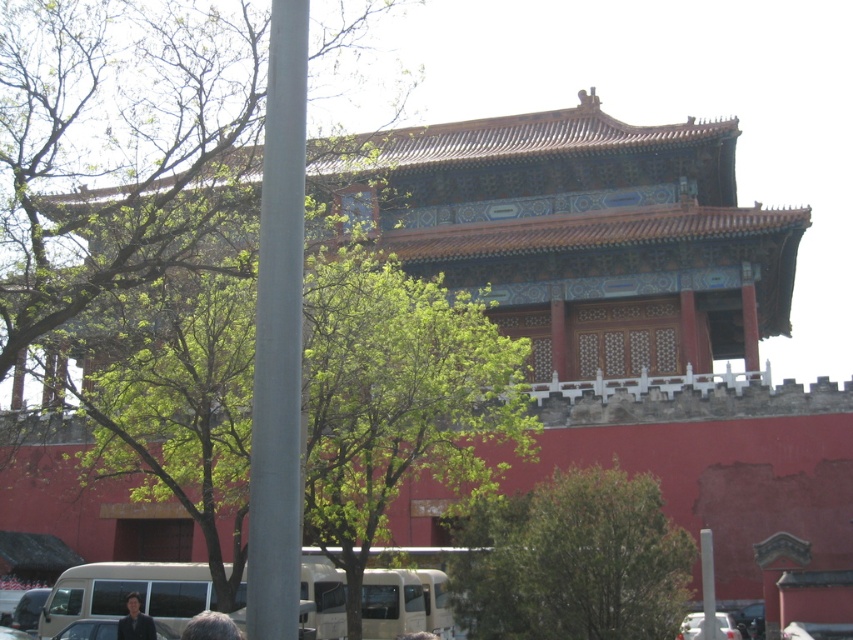
Question: Which point is farther to the camera?

Choices:
 (A) white matte car at lower right
 (B) dark brown hair at lower center
 (C) gray hair at center

Answer: (A)

Question: Does green leafy tree at center appear under white glossy pole at lower right?

Choices:
 (A) no
 (B) yes

Answer: (A)

Question: Can you confirm if white glossy pole at lower right is positioned below white matte car at lower right?

Choices:
 (A) yes
 (B) no

Answer: (B)

Question: Is white glossy pole at lower right positioned before gray hair at center?

Choices:
 (A) yes
 (B) no

Answer: (B)

Question: Which is nearer to the gray hair at center?

Choices:
 (A) dark brown hair at lower center
 (B) white matte car at lower right

Answer: (A)

Question: Estimate the real-world distances between objects in this image. Which object is farther from the metallic gray pole at left?

Choices:
 (A) dark blue shirt at lower center
 (B) dark brown hair at lower center
 (C) green leafy tree at center
 (D) white matte car at lower right

Answer: (D)